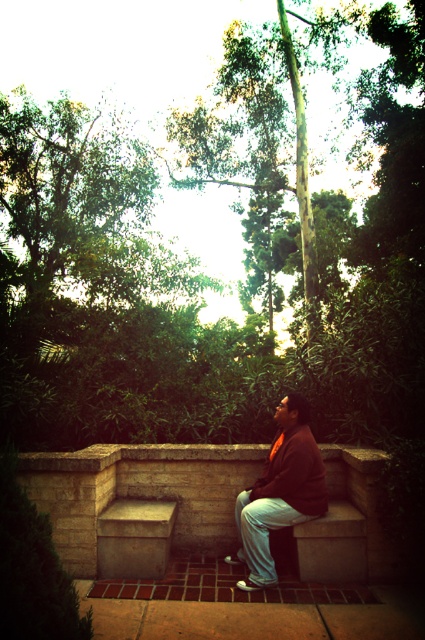
Question: Among these objects, which one is farthest from the camera?

Choices:
 (A) stone bench at center
 (B) matte brown jacket at center

Answer: (A)

Question: Is stone bench at center above matte brown jacket at center?

Choices:
 (A) yes
 (B) no

Answer: (B)

Question: Can you confirm if stone bench at center is smaller than matte brown jacket at center?

Choices:
 (A) yes
 (B) no

Answer: (B)

Question: Which point appears farthest from the camera in this image?

Choices:
 (A) (314, 492)
 (B) (187, 465)

Answer: (B)

Question: Observing the image, what is the correct spatial positioning of stone bench at center in reference to matte brown jacket at center?

Choices:
 (A) below
 (B) above

Answer: (A)